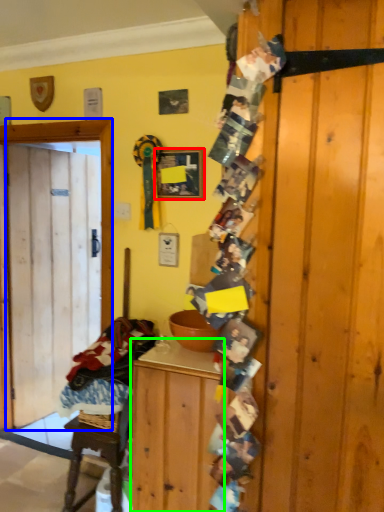
Question: Based on their relative distances, which object is farther from picture frame (highlighted by a red box)? Choose from door (highlighted by a blue box) and cabinetry (highlighted by a green box).

Choices:
 (A) door
 (B) cabinetry

Answer: (B)